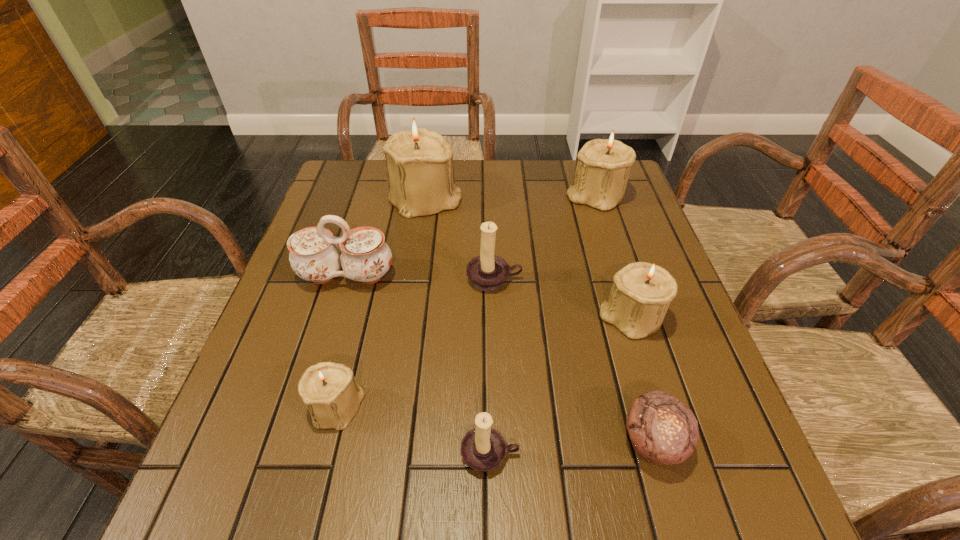
Find the location of a particular element. The width and height of the screenshot is (960, 540). the nearest beige candle_holder is located at coordinates (332, 395).

The image size is (960, 540). Identify the location of the nearest candle holder. point(483,448).

Find the location of a particular element. the nearer brown candle holder is located at coordinates (483, 448).

Find the location of a particular element. The image size is (960, 540). the shortest object is located at coordinates (663, 431).

Where is `free space located 0.180m on the front of the biggest beige candle_holder`? free space located 0.180m on the front of the biggest beige candle_holder is located at coordinates (416, 264).

In order to click on vacant point located 0.180m on the left of the second biggest beige candle_holder in this screenshot , I will do `click(504, 195)`.

The image size is (960, 540). In order to click on vacant space located by the handle of the chinaware in this screenshot , I will do coord(303,416).

Locate an element on the screen. Image resolution: width=960 pixels, height=540 pixels. vacant space located 0.220m on the back of the third farthest beige candle_holder is located at coordinates (606, 234).

The height and width of the screenshot is (540, 960). Find the location of `vacant area situated on the wick of the farther brown candle holder`. vacant area situated on the wick of the farther brown candle holder is located at coordinates (498, 423).

You are a GUI agent. You are given a task and a screenshot of the screen. Output one action in this format:
    pyautogui.click(x=<x>, y=<y>)
    Task: Click on the blank space located on the back of the fifth farthest candle holder
    The height and width of the screenshot is (540, 960).
    Given the screenshot: What is the action you would take?
    pyautogui.click(x=374, y=256)